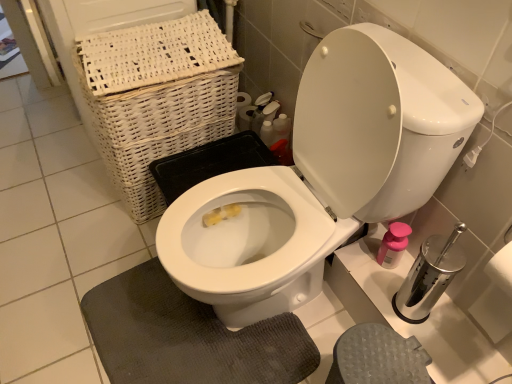
Question: Can you confirm if gray textured bath mat at lower center is taller than silver metallic toilet paper at right?

Choices:
 (A) yes
 (B) no

Answer: (B)

Question: Does gray textured bath mat at lower center have a lesser height compared to silver metallic toilet paper at right?

Choices:
 (A) yes
 (B) no

Answer: (A)

Question: Can you confirm if gray textured bath mat at lower center is bigger than silver metallic toilet paper at right?

Choices:
 (A) no
 (B) yes

Answer: (B)

Question: Is gray textured bath mat at lower center next to silver metallic toilet paper at right?

Choices:
 (A) yes
 (B) no

Answer: (B)

Question: Does gray textured bath mat at lower center appear on the left side of silver metallic toilet paper at right?

Choices:
 (A) no
 (B) yes

Answer: (B)

Question: From the image's perspective, is gray textured bath mat at lower center beneath silver metallic toilet paper at right?

Choices:
 (A) no
 (B) yes

Answer: (B)

Question: Is silver metallic toilet paper at right directly adjacent to white wicker basket at upper left?

Choices:
 (A) yes
 (B) no

Answer: (B)

Question: Is white wicker basket at upper left a part of silver metallic toilet paper at right?

Choices:
 (A) yes
 (B) no

Answer: (B)

Question: From a real-world perspective, is silver metallic toilet paper at right physically below white wicker basket at upper left?

Choices:
 (A) no
 (B) yes

Answer: (A)

Question: From the image's perspective, is silver metallic toilet paper at right located beneath white wicker basket at upper left?

Choices:
 (A) yes
 (B) no

Answer: (A)

Question: Is silver metallic toilet paper at right bigger than white wicker basket at upper left?

Choices:
 (A) no
 (B) yes

Answer: (A)

Question: Is silver metallic toilet paper at right aimed at white wicker basket at upper left?

Choices:
 (A) yes
 (B) no

Answer: (B)

Question: From the image's perspective, does silver metallic toilet paper at right appear higher than gray textured bath mat at lower center?

Choices:
 (A) no
 (B) yes

Answer: (B)